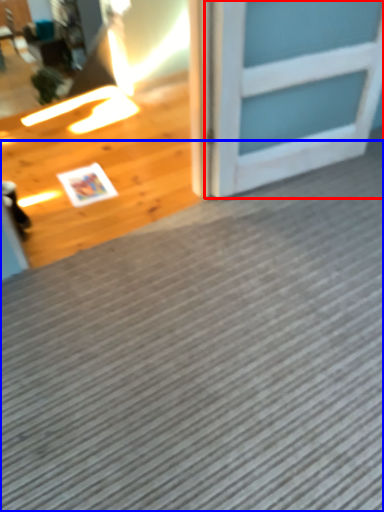
Question: Which object is further to the camera taking this photo, door (highlighted by a red box) or doormat (highlighted by a blue box)?

Choices:
 (A) door
 (B) doormat

Answer: (A)